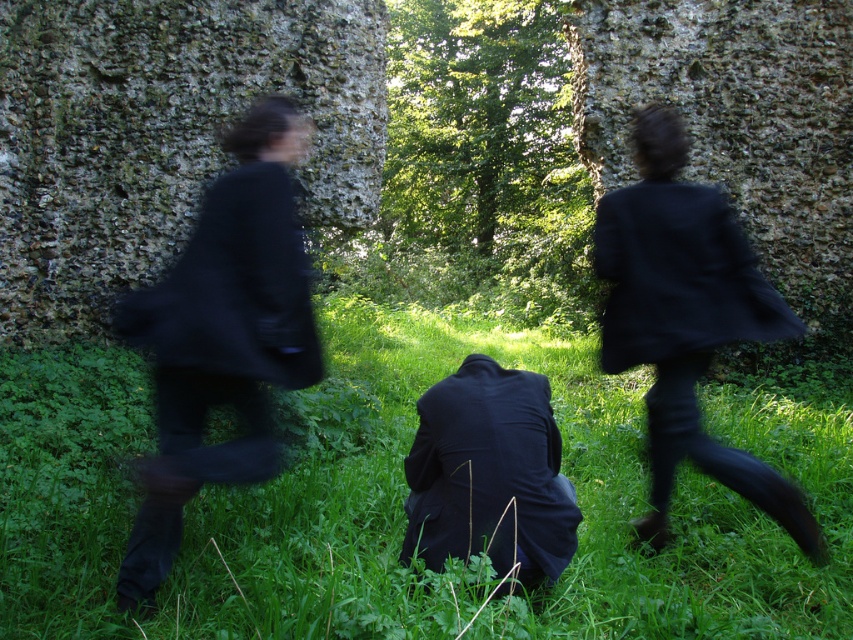
You are standing in the grassy area between the two ancient stone walls and see two points marked in the scene. Which point is closer to you, point (347, 506) or point (537, 493)?

Point (347, 506) is closer to you because it is further to the viewer than point (537, 493).